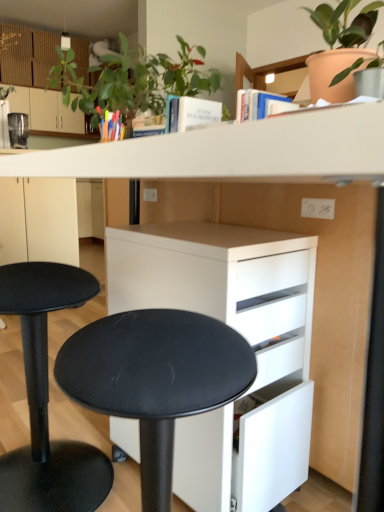
Question: From a real-world perspective, is translucent plastic pen holder at upper center positioned above or below white matte cabinet at lower center, the 2th cabinetry viewed from the top?

Choices:
 (A) above
 (B) below

Answer: (A)

Question: Considering the positions of translucent plastic pen holder at upper center and white matte cabinet at lower center, the first cabinetry in the bottom-to-top sequence, in the image, is translucent plastic pen holder at upper center taller or shorter than white matte cabinet at lower center, the first cabinetry in the bottom-to-top sequence,?

Choices:
 (A) short
 (B) tall

Answer: (A)

Question: Which of these objects is positioned closest to the terracotta clay pot at upper right, which is the second houseplant in left-to-right order?

Choices:
 (A) black matte stool at lower left
 (B) white matte cabinet at lower center, the 2th cabinetry positioned from the back
 (C) translucent plastic pen holder at upper center
 (D) matte black coffee maker at left
 (E) green leafy plant at upper left, which is counted as the 2th houseplant, starting from the right

Answer: (E)

Question: Which object is the closest to the green leafy plant at upper left, which is counted as the 2th houseplant, starting from the right?

Choices:
 (A) matte black coffee maker at left
 (B) translucent plastic pen holder at upper center
 (C) matte beige cabinet at upper left, which is the second cabinetry from bottom to top
 (D) white matte cabinet at lower center, the first cabinetry in the bottom-to-top sequence
 (E) black matte stool at lower left

Answer: (B)